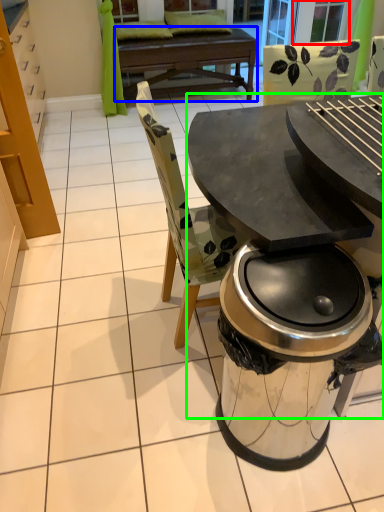
Question: Based on their relative distances, which object is nearer to screen door (highlighted by a red box)? Choose from round table (highlighted by a blue box) and table (highlighted by a green box).

Choices:
 (A) round table
 (B) table

Answer: (A)